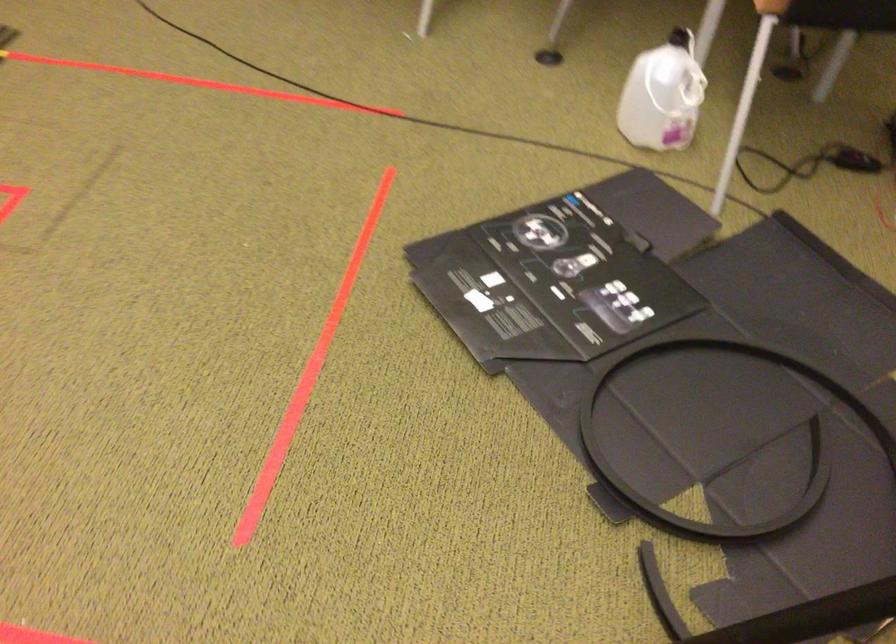
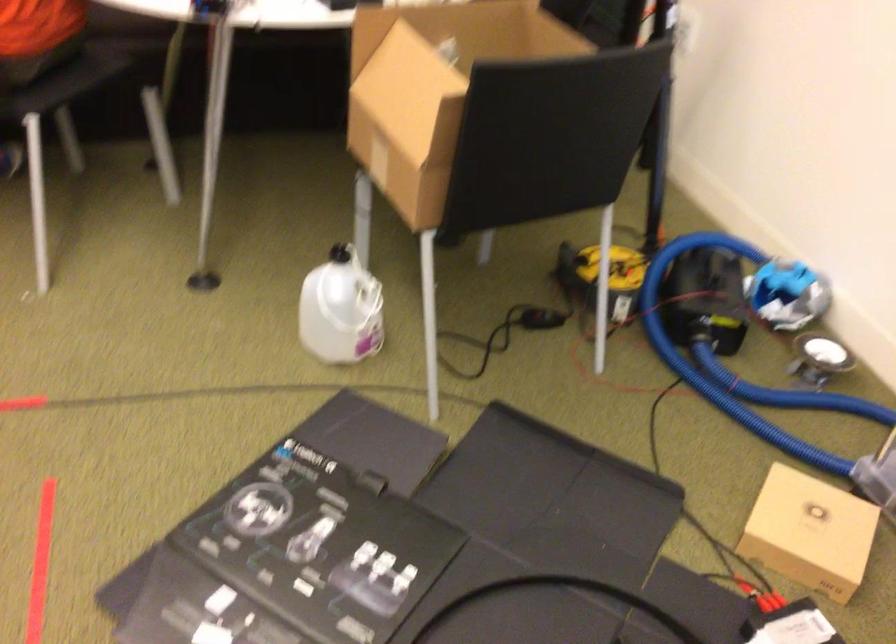
In the second image, find the point that corresponds to point 685,93 in the first image.

(367, 305)